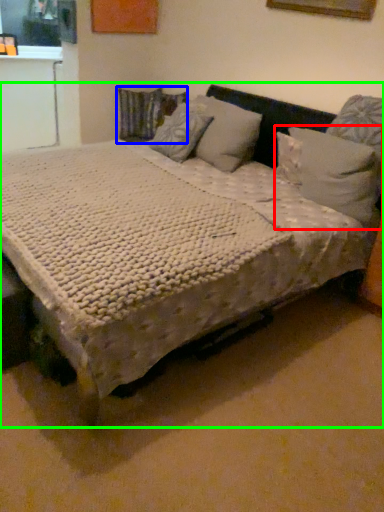
Question: Which is nearer to the pillow (highlighted by a red box)? pillow (highlighted by a blue box) or bed (highlighted by a green box).

Choices:
 (A) pillow
 (B) bed

Answer: (B)